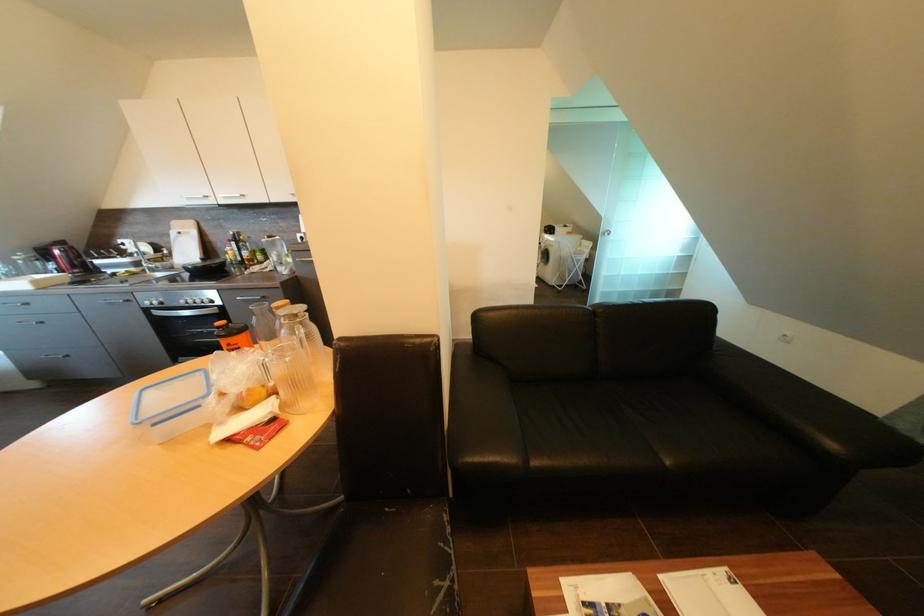
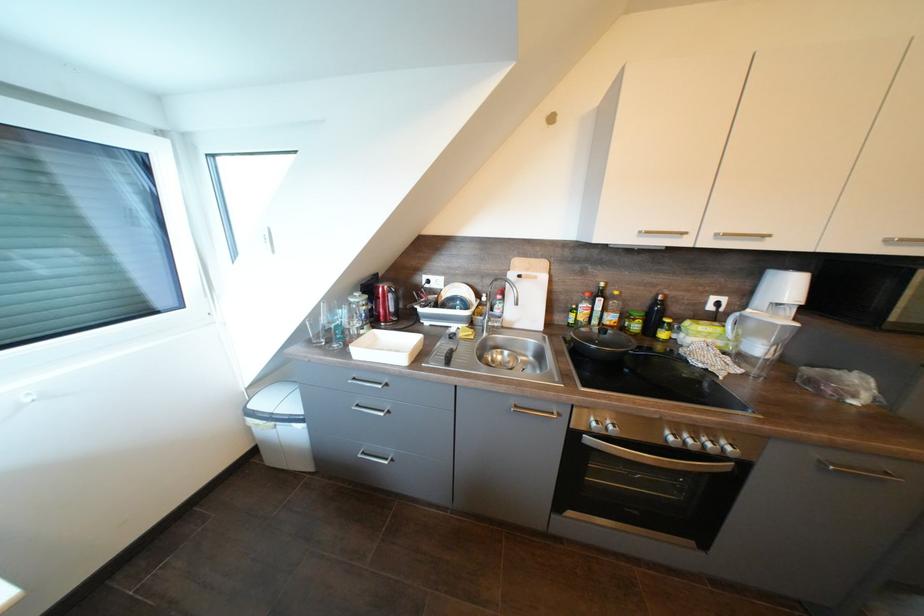
Question: What movement of the cameraman would produce the second image?

Choices:
 (A) Left
 (B) Right
 (C) Forward
 (D) Backward

Answer: (A)